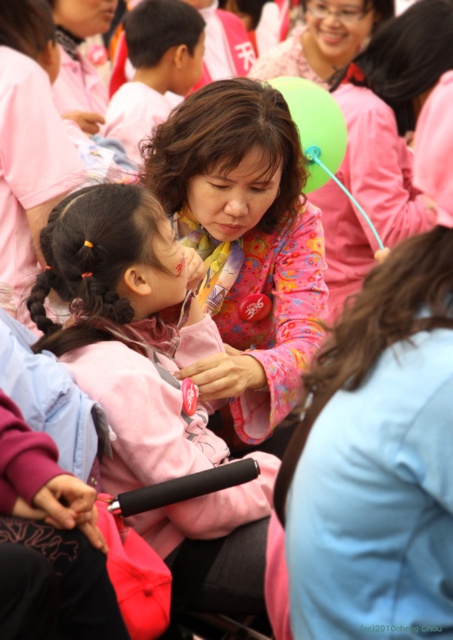
You are organizing a fashion show and need to arrange the pink fabric at center and the light pink fabric at upper left based on their sizes. Which fabric should be placed first if you want to arrange them from smallest to largest?

The pink fabric at center has a smaller size compared to light pink fabric at upper left, so it should be placed first in the arrangement from smallest to largest.

You are a photographer standing at the camera position. You want to take a closeup photo of the pink fabric jacket at center. The camera has a minimum focusing distance of 2 meters. Can you take the photo without moving closer?

The distance between the pink fabric jacket at center and the camera is 3.61 meters, which is greater than the minimum focusing distance of 2 meters. Therefore, you can take the closeup photo without moving closer.

You are a photographer at the event and want to capture a clear photo of both the pink fabric jacket at center and the matte pink blouse at center. Which one will appear larger in the photo?

The pink fabric jacket at center will appear larger in the photo because it is closer to the viewer than the matte pink blouse at center.